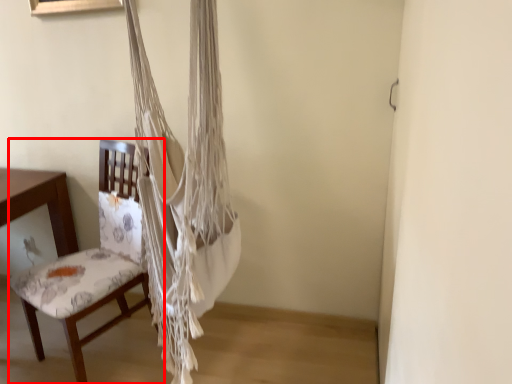
Question: From the image's perspective, where is chair (annotated by the red box) located relative to curtain?

Choices:
 (A) below
 (B) above

Answer: (A)